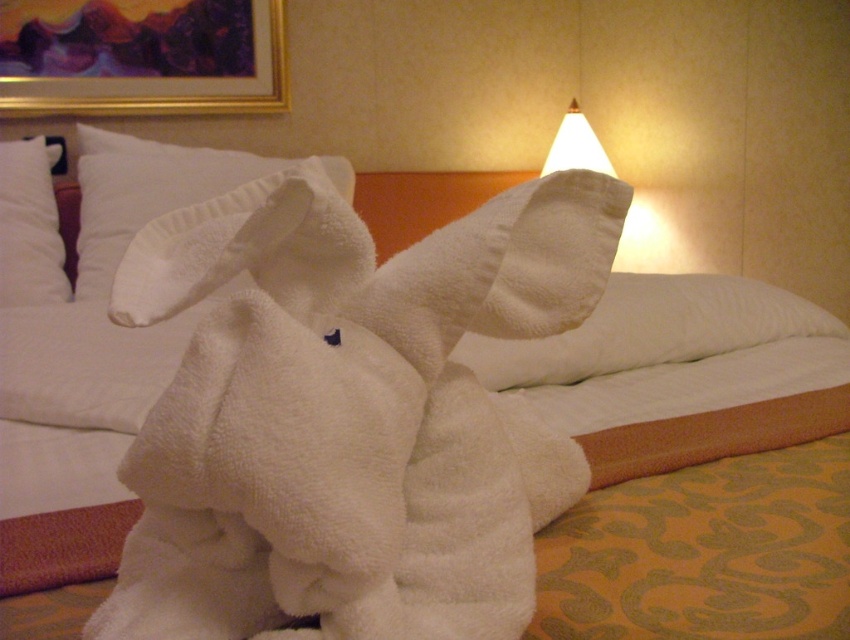
Is white quilted pillow at center wider than white soft pillow at center?

Correct, the width of white quilted pillow at center exceeds that of white soft pillow at center.

Can you confirm if white quilted pillow at center is bigger than white soft pillow at center?

Actually, white quilted pillow at center might be smaller than white soft pillow at center.

Who is more distant from viewer, (x=650, y=305) or (x=221, y=179)?

The point (x=221, y=179) is more distant.

Where is `white quilted pillow at center`? This screenshot has height=640, width=850. white quilted pillow at center is located at coordinates (650, 330).

Is white soft pillow at center closer to camera compared to white paper lampshade at upper center?

Yes, white soft pillow at center is closer to the viewer.

Does white soft pillow at center have a lesser height compared to white paper lampshade at upper center?

In fact, white soft pillow at center may be taller than white paper lampshade at upper center.

Who is more distant from viewer, (154, 156) or (592, 131)?

Point (592, 131)

You are a GUI agent. You are given a task and a screenshot of the screen. Output one action in this format:
    pyautogui.click(x=<x>, y=<y>)
    Task: Click on the white soft pillow at center
    The image size is (850, 640).
    Given the screenshot: What is the action you would take?
    pyautogui.click(x=143, y=193)

Between white soft pillow at center and white soft pillow at upper left, which one is positioned higher?

white soft pillow at center

Which of these two, white soft pillow at center or white soft pillow at upper left, stands taller?

white soft pillow at center

What do you see at coordinates (143, 193) in the screenshot?
I see `white soft pillow at center` at bounding box center [143, 193].

I want to click on white soft pillow at center, so click(143, 193).